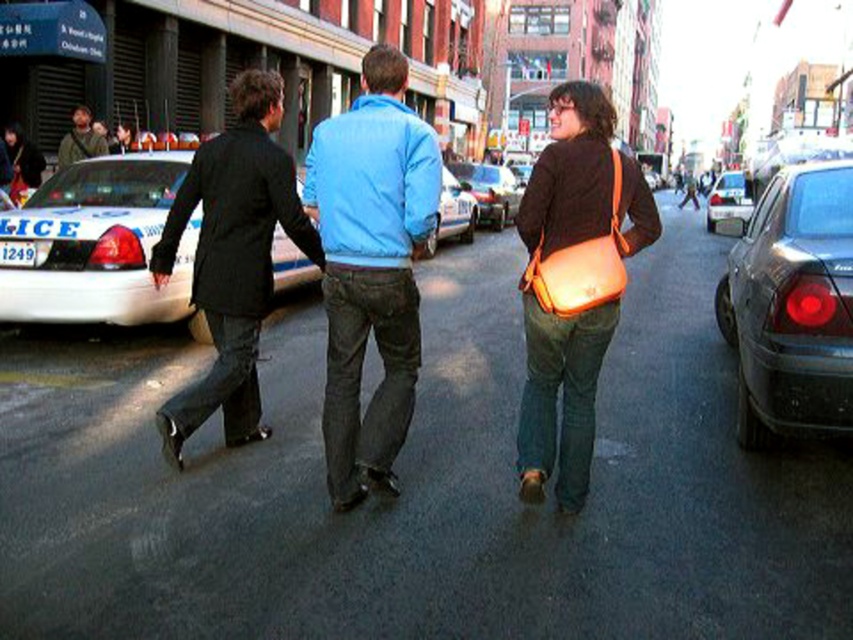
Does white glossy police car at left appear on the right side of matte black jacket at left?

Indeed, white glossy police car at left is positioned on the right side of matte black jacket at left.

Which of these two, white glossy police car at left or matte black jacket at left, stands shorter?

Standing shorter between the two is matte black jacket at left.

This screenshot has height=640, width=853. What are the coordinates of `white glossy police car at left` in the screenshot? It's located at (97, 244).

In the scene shown: Is black matte suit at left to the right of metallic blue sedan at center from the viewer's perspective?

Incorrect, black matte suit at left is not on the right side of metallic blue sedan at center.

Between black matte suit at left and metallic blue sedan at center, which one appears on the right side from the viewer's perspective?

metallic blue sedan at center is more to the right.

Between point (234, 422) and point (466, 225), which one is positioned in front?

Point (234, 422) is in front.

This screenshot has height=640, width=853. I want to click on black matte suit at left, so (231, 259).

The image size is (853, 640). What do you see at coordinates (370, 268) in the screenshot?
I see `blue denim jeans at center` at bounding box center [370, 268].

How much distance is there between blue denim jeans at center and matte orange bag at center?

The distance of blue denim jeans at center from matte orange bag at center is 1.26 meters.

Between point (332, 410) and point (543, 461), which one is positioned behind?

The point (332, 410) is behind.

This screenshot has width=853, height=640. In order to click on blue denim jeans at center in this screenshot , I will do `click(370, 268)`.